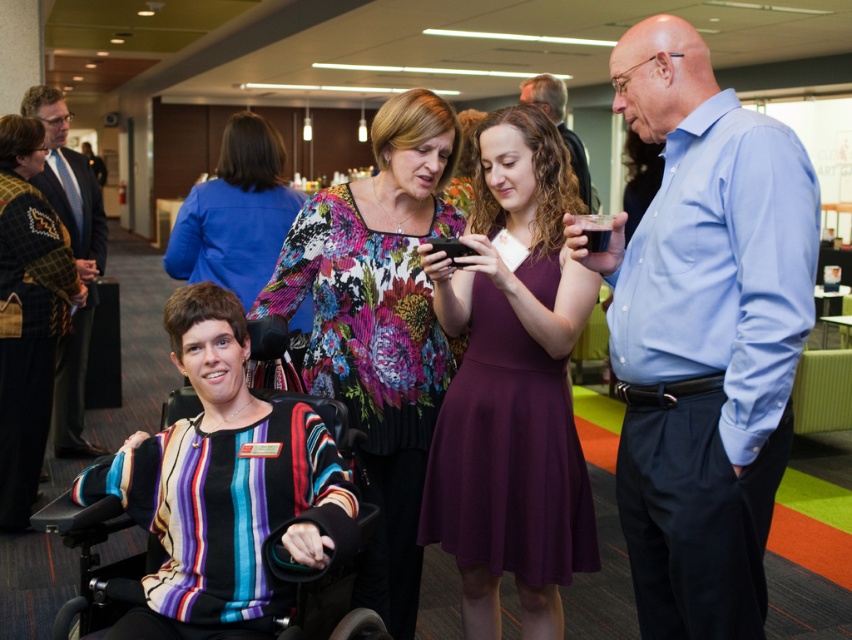
You are at a conference and need to move from the point closer to you to the point further away. Which path would you take between the two points, point (717, 268) and point (548, 77)?

You should move from point (717, 268) to point (548, 77) since point (717, 268) is closer to the viewer and you need to go to the point further away.

You are organizing a photo shoot and need to position a model wearing the purple satin dress at center. According to the scene description, where should the model be placed in relation to the other elements in the room?

The purple satin dress at center should be placed at the coordinates point [511,387] as specified in the description.